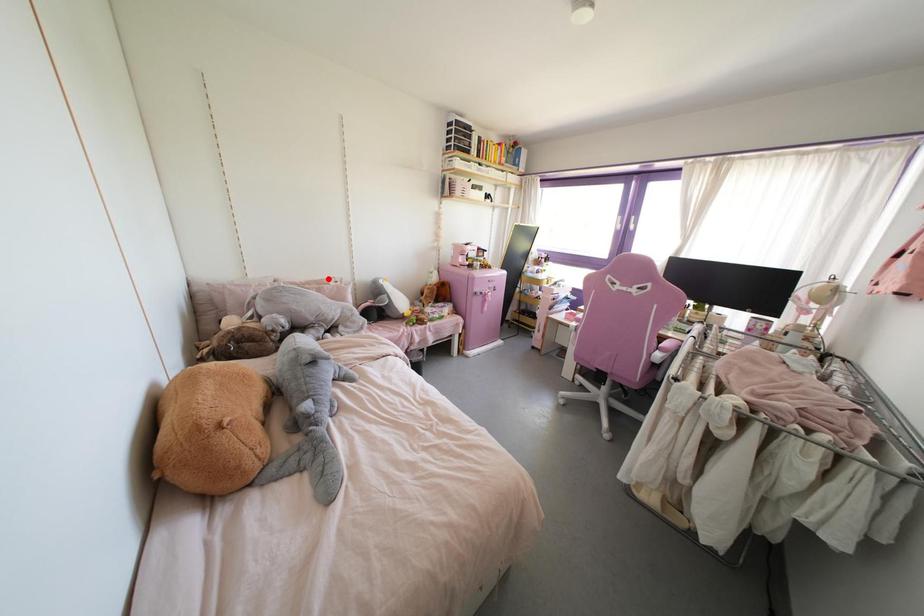
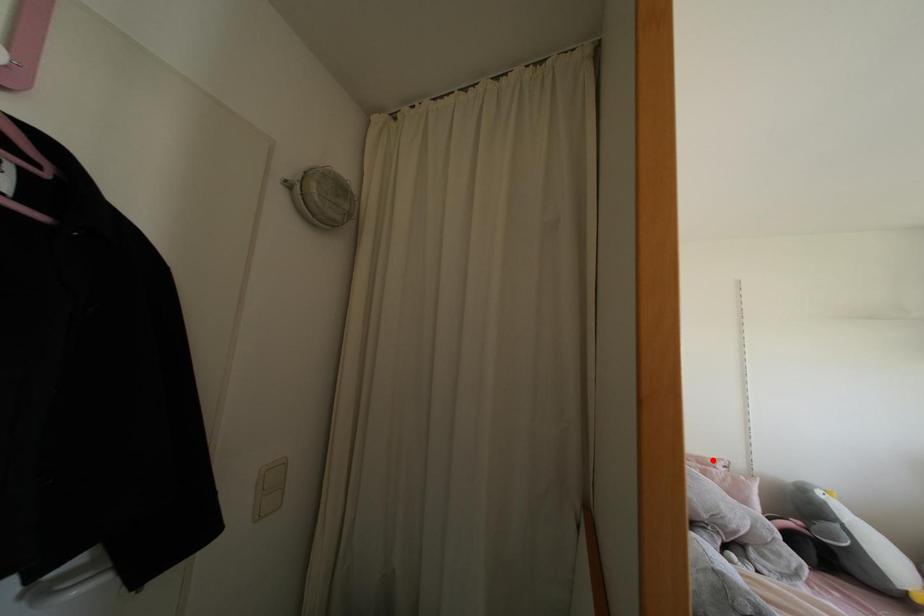
I am providing you with two images of the same scene from different viewpoints. A red point is marked on the first image and another point is marked on the second image. Is the marked point in image1 the same physical position as the marked point in image2?

Yes